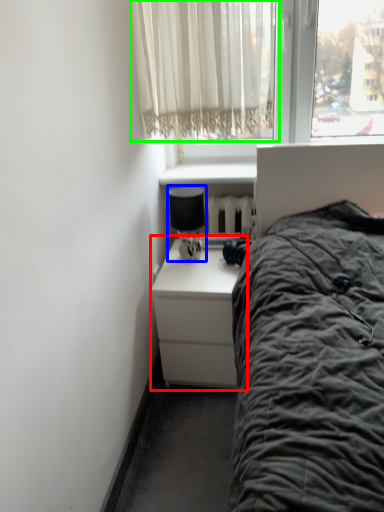
Question: Which object is positioned farthest from nightstand (highlighted by a red box)? Select from lamp (highlighted by a blue box) and curtain (highlighted by a green box).

Choices:
 (A) lamp
 (B) curtain

Answer: (B)